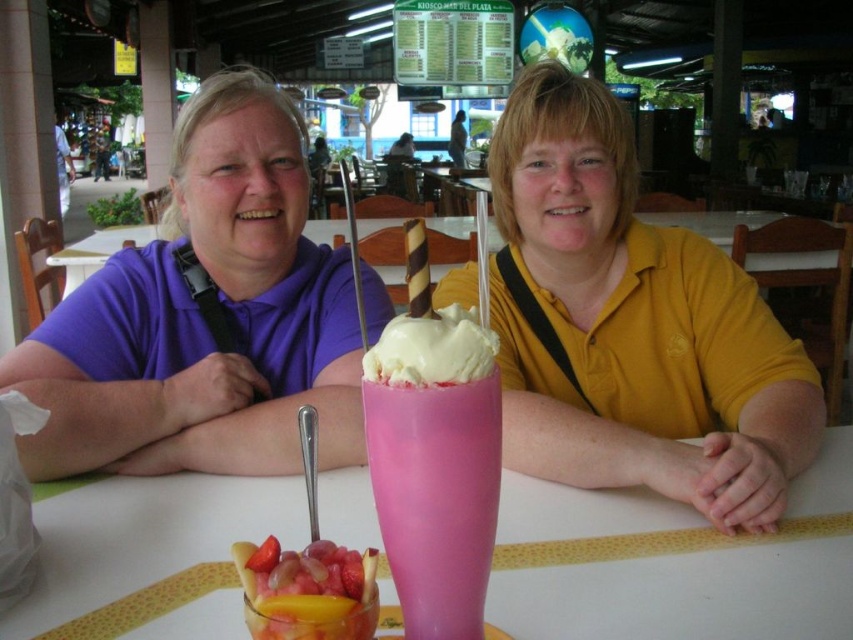
You are a waiter at this outdoor table. You need to place a new dessert menu between the pink glass milkshake at center and the purple matte shirt at center. Which object should you move to make space, and why?

You should move the pink glass milkshake at center because its width is larger than the purple matte shirt at center, so moving the milkshake would create more space for the dessert menu.

You are a waiter at this outdoor table. You need to place a new dessert menu between the pink glass milkshake at center and the purple matte shirt at center. Based on their positions, where should you place the menu so it doesn

The pink glass milkshake at center is positioned under the purple matte shirt at center. Therefore, the dessert menu should be placed between them, likely below the purple matte shirt at center and above the pink glass milkshake at center to ensure it is accessible and visible.